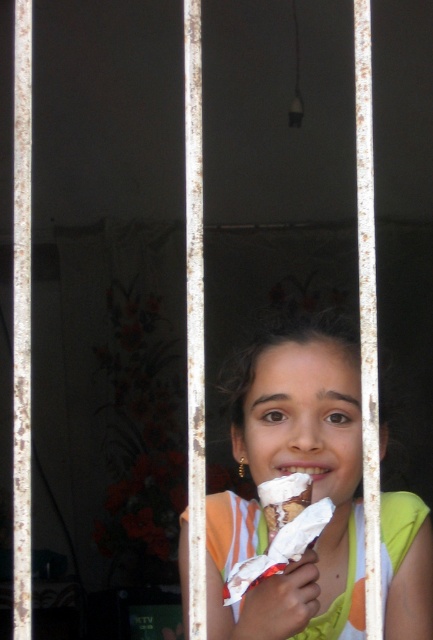
Is yellow fabric safety vest at center positioned in front of white creamy ice cream cone at center?

That is True.

Can you confirm if yellow fabric safety vest at center is taller than white creamy ice cream cone at center?

Correct, yellow fabric safety vest at center is much taller as white creamy ice cream cone at center.

Who is more distant from viewer, (400, 540) or (300, 499)?

Point (400, 540)

Locate an element on the screen. Image resolution: width=433 pixels, height=640 pixels. yellow fabric safety vest at center is located at coordinates (232, 531).

Does matte white ice cream cone at center have a lesser height compared to white creamy ice cream cone at center?

No, matte white ice cream cone at center is not shorter than white creamy ice cream cone at center.

Does point (381, 538) come farther from viewer compared to point (267, 496)?

Yes, point (381, 538) is farther from viewer.

In order to click on matte white ice cream cone at center in this screenshot , I will do `click(288, 472)`.

In the scene shown: Between matte white ice cream cone at center and yellow fabric safety vest at center, which one has less height?

With less height is yellow fabric safety vest at center.

Which is more to the right, matte white ice cream cone at center or yellow fabric safety vest at center?

matte white ice cream cone at center is more to the right.

Which is behind, point (255, 538) or point (252, 538)?

Point (252, 538)

Where is `matte white ice cream cone at center`? The image size is (433, 640). matte white ice cream cone at center is located at coordinates (288, 472).